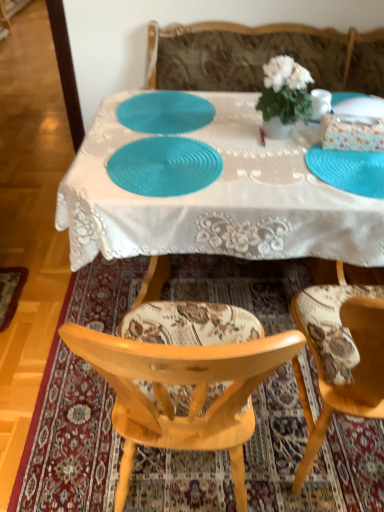
Question: Looking at their shapes, would you say patterned fabric chair at center is wider or thinner than white matte flower pot at center?

Choices:
 (A) thin
 (B) wide

Answer: (B)

Question: From the image's perspective, is patterned fabric chair at center positioned above or below white matte flower pot at center?

Choices:
 (A) above
 (B) below

Answer: (B)

Question: Which of these objects is positioned farthest from the floral fabric chair at lower center?

Choices:
 (A) patterned fabric chair at center
 (B) blue rubber placemat at lower right, the 3th plate from the left
 (C) white lace tablecloth at center
 (D) blue textured placemat at center, which is counted as the 3th plate, starting from the right
 (E) camouflage fabric couch at center

Answer: (E)

Question: Estimate the real-world distances between objects in this image. Which object is farther from the floral fabric chair at lower center?

Choices:
 (A) teal textured plate at center, acting as the second plate starting from the right
 (B) blue rubber placemat at lower right, the 1th plate viewed from the right
 (C) blue textured placemat at center, the 1th plate positioned from the left
 (D) camouflage fabric couch at center
 (E) white lace tablecloth at center

Answer: (D)